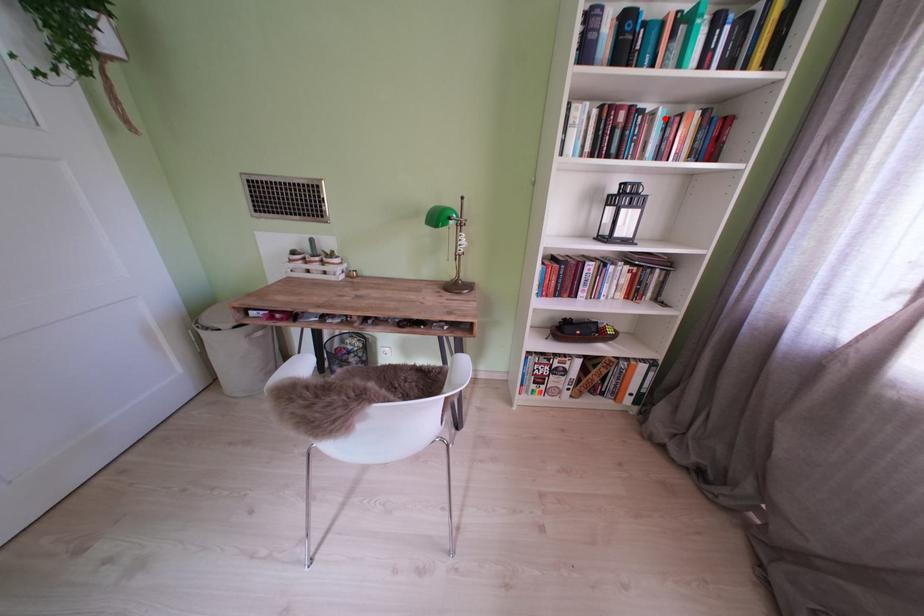
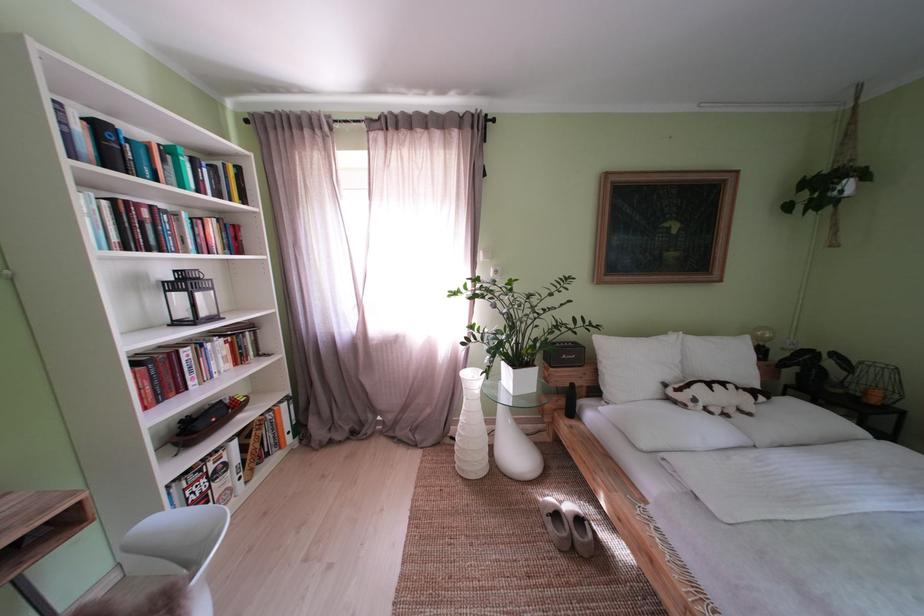
Locate, in the second image, the point that corresponds to the highlighted location in the first image.

(188, 220)